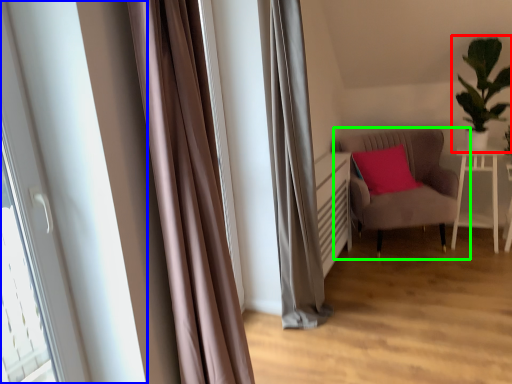
Question: Considering the real-world distances, which object is closest to houseplant (highlighted by a red box)? bay window (highlighted by a blue box) or chair (highlighted by a green box).

Choices:
 (A) bay window
 (B) chair

Answer: (B)